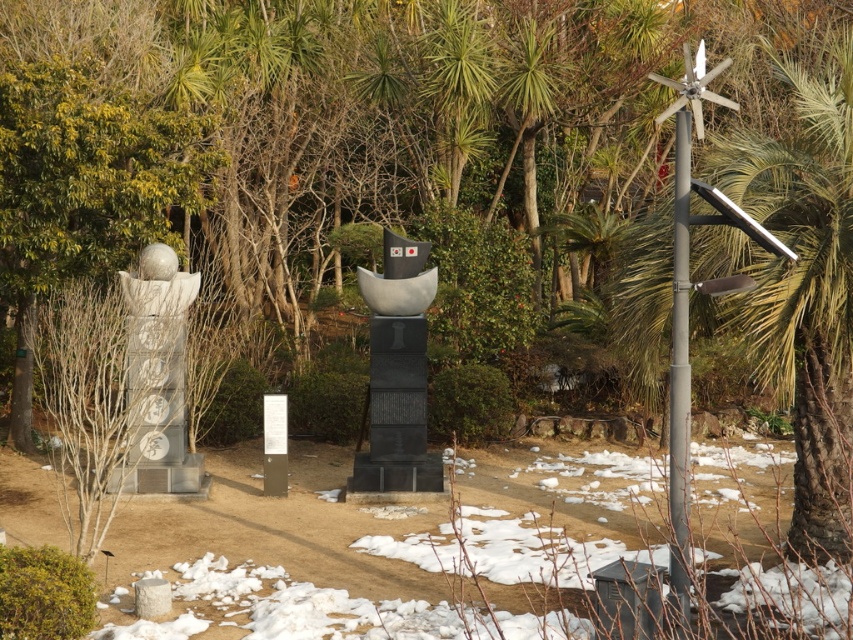
Question: Can you confirm if black polished stone monument at center is bigger than gray metallic pole at right?

Choices:
 (A) yes
 (B) no

Answer: (B)

Question: Considering the real-world distances, which object is closest to the white stone statue at left?

Choices:
 (A) black polished stone monument at center
 (B) gray metallic pole at right
 (C) green leafy palm tree at right

Answer: (A)

Question: Is green leafy palm tree at right wider than gray metallic pole at right?

Choices:
 (A) yes
 (B) no

Answer: (A)

Question: Among these points, which one is nearest to the camera?

Choices:
 (A) (669, 420)
 (B) (373, 420)
 (C) (157, 301)

Answer: (A)

Question: Can you confirm if black polished stone monument at center is thinner than white stone statue at left?

Choices:
 (A) no
 (B) yes

Answer: (A)

Question: Considering the real-world distances, which object is closest to the green leafy palm tree at right?

Choices:
 (A) white stone statue at left
 (B) gray metallic pole at right

Answer: (B)